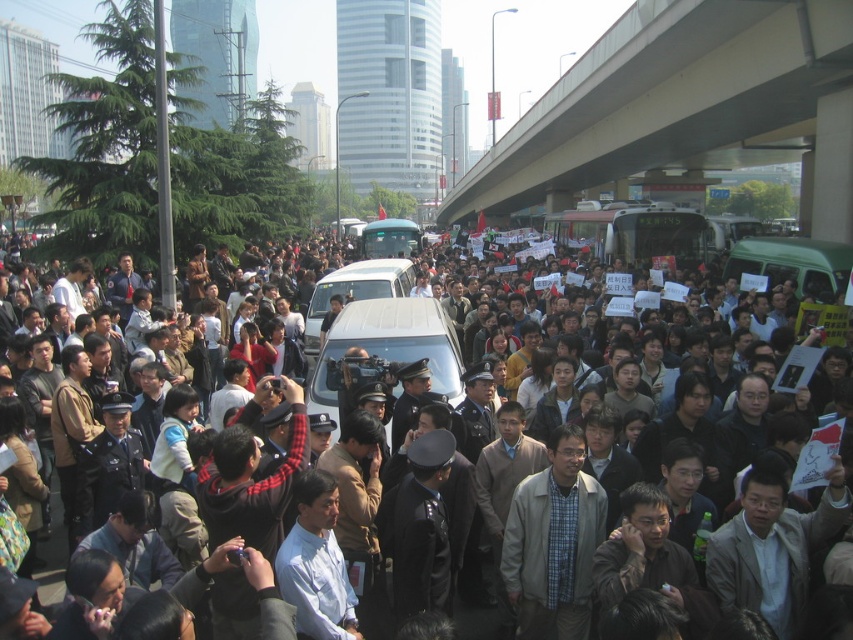
You are a protester trying to cross the bridge. The concrete bridge at upper right is above the dark gray uniformed officers at center. To avoid confrontation, which direction should you move to get away from the officers?

Move away from the concrete bridge at upper right since it is positioned over the dark gray uniformed officers at center, meaning moving towards the opposite side of the bridge would distance you from the officers.

You are a photographer trying to capture a wide shot of the protest scene. You notice the concrete bridge at upper right and the dark gray uniformed officers at center. Which object is wider in the image?

The concrete bridge at upper right is wider than the dark gray uniformed officers at center.

You are a city planner analyzing this image of a protest in an urban area. You notice a point marked at coordinates (685,108). What does this point represent in the scene?

The point at coordinates (685,108) represents the concrete bridge at upper right.